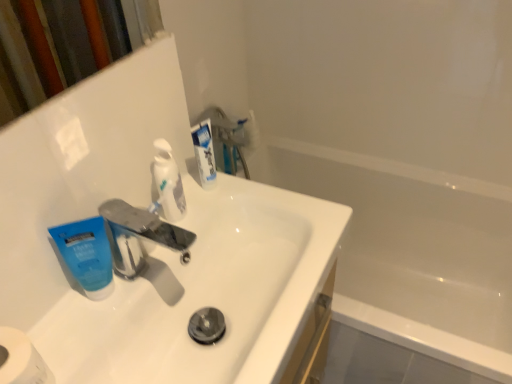
In order to click on free space in front of white glossy toothpaste at upper center, which ranks as the 3th toothpaste in left-to-right order in this screenshot , I will do `click(197, 236)`.